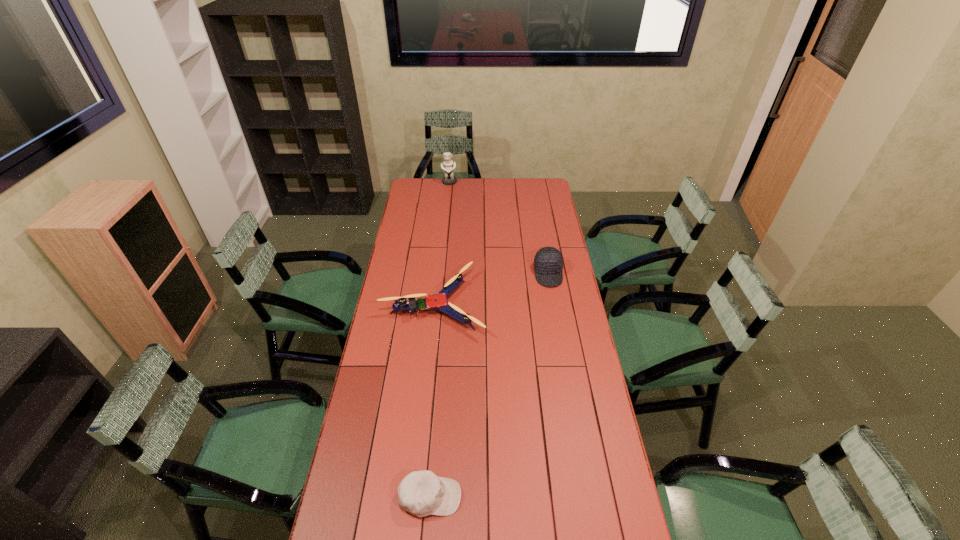
Choose which object is the third nearest neighbor to the drone. Please provide its 2D coordinates. Your answer should be formatted as a tuple, i.e. [(x, y)], where the tuple contains the x and y coordinates of a point satisfying the conditions above.

[(448, 166)]

I want to click on free space that satisfies the following two spatial constraints: 1. at the front of the right baseball cap where the brim is located; 2. on the front-facing side of the shorter baseball cap, so click(x=587, y=497).

In order to click on free space that satisfies the following two spatial constraints: 1. at the front of the rightmost object where the brim is located; 2. on the front-facing side of the nearest object in this screenshot , I will do `click(587, 497)`.

The width and height of the screenshot is (960, 540). I want to click on blank space that satisfies the following two spatial constraints: 1. at the front of the taller baseball cap where the brim is located; 2. on the front-facing side of the nearer baseball cap, so click(587, 497).